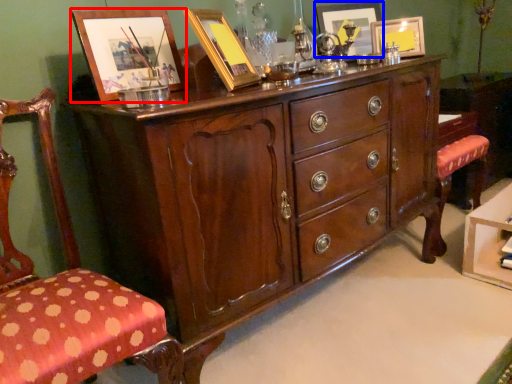
Question: Which object is closer to the camera taking this photo, picture frame (highlighted by a red box) or picture frame (highlighted by a blue box)?

Choices:
 (A) picture frame
 (B) picture frame

Answer: (A)